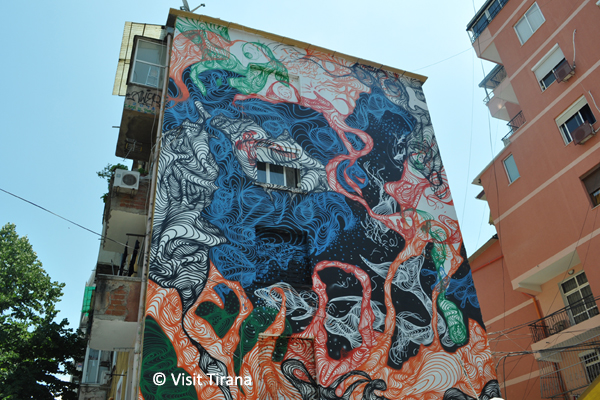
This screenshot has height=400, width=600. I want to click on ac units, so click(127, 175), click(565, 68), click(586, 129).